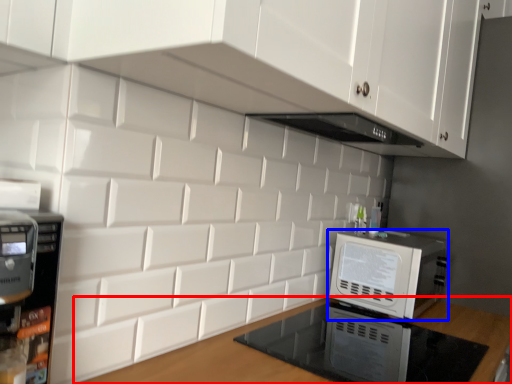
Question: Which object appears farthest to the camera in this image, countertop (highlighted by a red box) or home appliance (highlighted by a blue box)?

Choices:
 (A) countertop
 (B) home appliance

Answer: (B)